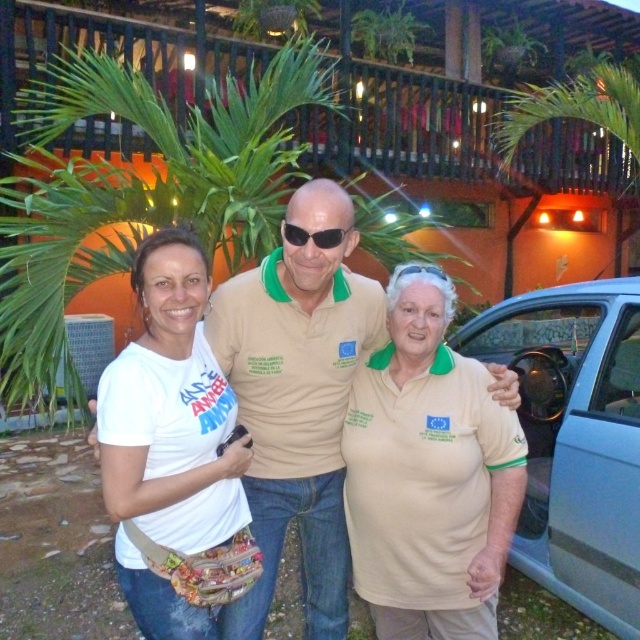
Which is above, beige cotton polo shirt at center or white cotton shirt at left?

white cotton shirt at left is higher up.

Does point (444, 419) come closer to viewer compared to point (320, 452)?

Yes, point (444, 419) is in front of point (320, 452).

Locate an element on the screen. This screenshot has height=640, width=640. beige cotton polo shirt at center is located at coordinates (428, 476).

Is sunglasses at center to the left of clear plastic goggles at center from the viewer's perspective?

Correct, you'll find sunglasses at center to the left of clear plastic goggles at center.

Which of these two, sunglasses at center or clear plastic goggles at center, stands shorter?

Standing shorter between the two is clear plastic goggles at center.

Does point (332, 244) come behind point (406, 269)?

No, (332, 244) is closer to viewer.

Image resolution: width=640 pixels, height=640 pixels. What are the coordinates of `sunglasses at center` in the screenshot? It's located at (314, 236).

Which is more to the left, white fabric shirt at center or sunglasses at center?

From the viewer's perspective, white fabric shirt at center appears more on the left side.

Does white fabric shirt at center have a lesser width compared to sunglasses at center?

Incorrect, white fabric shirt at center's width is not less than sunglasses at center's.

What do you see at coordinates (172, 410) in the screenshot? I see `white fabric shirt at center` at bounding box center [172, 410].

At what (x,y) coordinates should I click in order to perform the action: click on white fabric shirt at center. Please return your answer as a coordinate pair (x, y). Looking at the image, I should click on (172, 410).